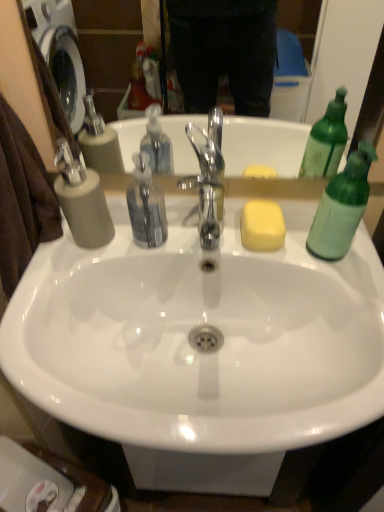
You are a GUI agent. You are given a task and a screenshot of the screen. Output one action in this format:
    pyautogui.click(x=<x>, y=<y>)
    Task: Click on the free spot in front of matte gray soap dispenser at left
    The image size is (384, 512).
    Given the screenshot: What is the action you would take?
    pyautogui.click(x=55, y=300)